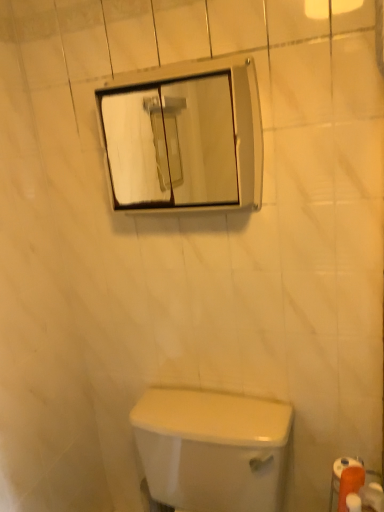
Question: Visually, is white glossy toilet at lower center positioned to the left or to the right of orange matte toilet paper at lower right, positioned as the 2th toilet paper in left-to-right order?

Choices:
 (A) left
 (B) right

Answer: (A)

Question: Is point coord(173,448) positioned closer to the camera than point coord(360,483)?

Choices:
 (A) farther
 (B) closer

Answer: (A)

Question: Estimate the real-world distances between objects in this image. Which object is closer to the clear glass mirror at upper center?

Choices:
 (A) white matte toilet paper at lower right, positioned as the 3th toilet paper in right-to-left order
 (B) orange matte toilet paper at lower right, marked as the 3th toilet paper in a left-to-right arrangement
 (C) white glossy toilet at lower center
 (D) orange matte toilet paper at lower right, which is counted as the 2th toilet paper, starting from the right

Answer: (C)

Question: Estimate the real-world distances between objects in this image. Which object is closer to the orange matte toilet paper at lower right, which is counted as the 2th toilet paper, starting from the right?

Choices:
 (A) clear glass mirror at upper center
 (B) orange matte toilet paper at lower right, placed as the 1th toilet paper when sorted from right to left
 (C) white matte toilet paper at lower right, the 1th toilet paper positioned from the left
 (D) white glossy toilet at lower center

Answer: (C)